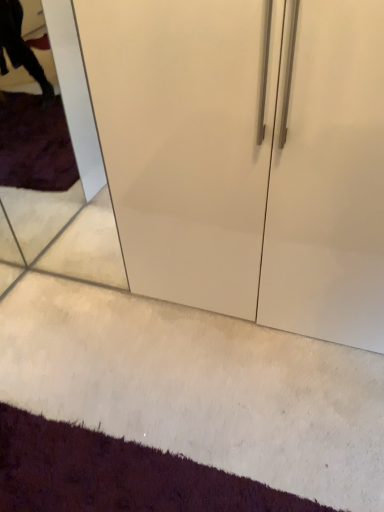
Question: From the image's perspective, would you say dark purple carpet at lower left is positioned over transparent glass door at left?

Choices:
 (A) no
 (B) yes

Answer: (A)

Question: Is dark purple carpet at lower left oriented towards transparent glass door at left?

Choices:
 (A) yes
 (B) no

Answer: (B)

Question: Is dark purple carpet at lower left at the right side of transparent glass door at left?

Choices:
 (A) no
 (B) yes

Answer: (B)

Question: Is dark purple carpet at lower left smaller than transparent glass door at left?

Choices:
 (A) yes
 (B) no

Answer: (A)

Question: Is dark purple carpet at lower left bigger than transparent glass door at left?

Choices:
 (A) no
 (B) yes

Answer: (A)

Question: From a real-world perspective, does dark purple carpet at lower left sit lower than transparent glass door at left?

Choices:
 (A) no
 (B) yes

Answer: (B)

Question: Is transparent glass door at left located outside dark purple carpet at lower left?

Choices:
 (A) yes
 (B) no

Answer: (A)

Question: Is transparent glass door at left in contact with dark purple carpet at lower left?

Choices:
 (A) no
 (B) yes

Answer: (A)

Question: From a real-world perspective, is transparent glass door at left below dark purple carpet at lower left?

Choices:
 (A) no
 (B) yes

Answer: (A)

Question: Does transparent glass door at left have a greater height compared to dark purple carpet at lower left?

Choices:
 (A) no
 (B) yes

Answer: (B)

Question: From a real-world perspective, does transparent glass door at left stand above dark purple carpet at lower left?

Choices:
 (A) yes
 (B) no

Answer: (A)

Question: Does transparent glass door at left appear on the left side of dark purple carpet at lower left?

Choices:
 (A) yes
 (B) no

Answer: (A)

Question: From the image's perspective, is transparent glass door at left above or below dark purple carpet at lower left?

Choices:
 (A) above
 (B) below

Answer: (A)